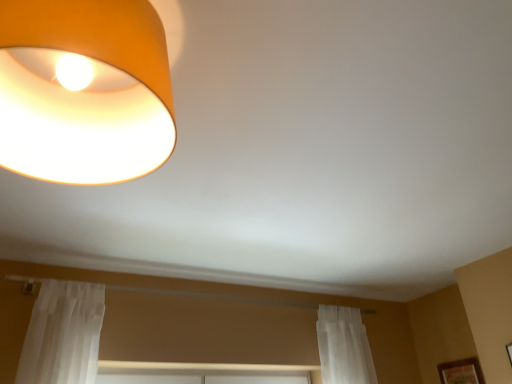
Question: Considering the positions of matte orange lampshade at upper left and wooden framed picture at lower right in the image, is matte orange lampshade at upper left bigger or smaller than wooden framed picture at lower right?

Choices:
 (A) small
 (B) big

Answer: (B)

Question: Looking at their shapes, would you say matte orange lampshade at upper left is wider or thinner than wooden framed picture at lower right?

Choices:
 (A) thin
 (B) wide

Answer: (B)

Question: Do you think matte orange lampshade at upper left is within wooden framed picture at lower right, or outside of it?

Choices:
 (A) outside
 (B) inside

Answer: (A)

Question: From a real-world perspective, is wooden framed picture at lower right physically located above or below matte orange lampshade at upper left?

Choices:
 (A) above
 (B) below

Answer: (B)

Question: Looking at their shapes, would you say wooden framed picture at lower right is wider or thinner than matte orange lampshade at upper left?

Choices:
 (A) wide
 (B) thin

Answer: (B)

Question: From the image's perspective, is wooden framed picture at lower right positioned above or below matte orange lampshade at upper left?

Choices:
 (A) below
 (B) above

Answer: (A)

Question: Which is correct: wooden framed picture at lower right is inside matte orange lampshade at upper left, or outside of it?

Choices:
 (A) outside
 (B) inside

Answer: (A)